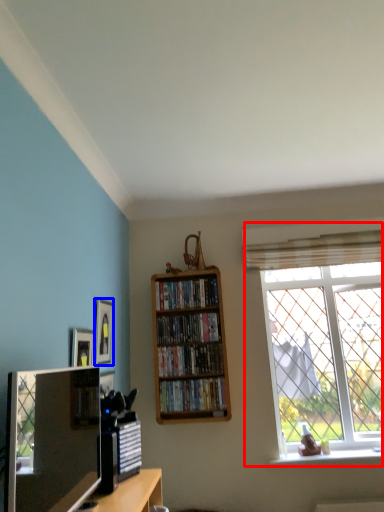
Question: Which of the following is the farthest to the observer, window (highlighted by a red box) or picture frame (highlighted by a blue box)?

Choices:
 (A) window
 (B) picture frame

Answer: (A)